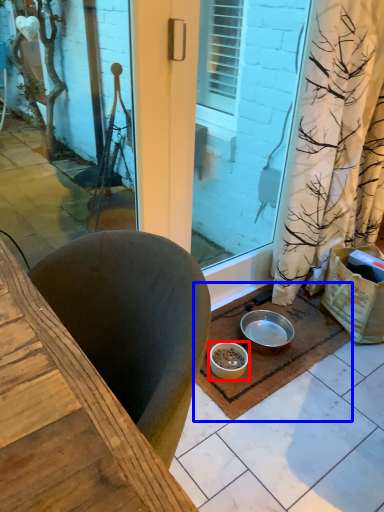
Question: Which object appears farthest to the camera in this image, bowl (highlighted by a red box) or doormat (highlighted by a blue box)?

Choices:
 (A) bowl
 (B) doormat

Answer: (A)